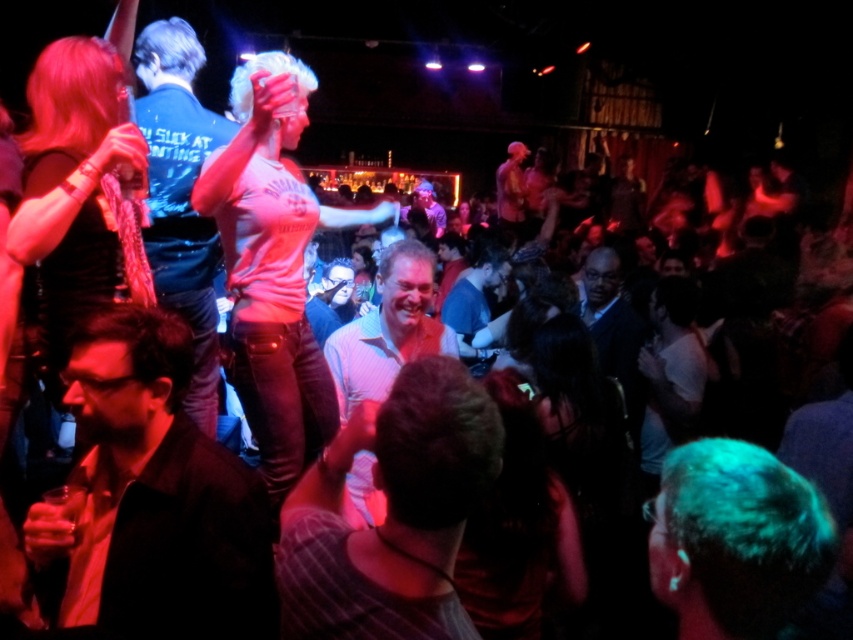
You are at a party and want to find the person with the shiny metallic shirt at center. Which direction should you look relative to the green matte hair at lower right?

The shiny metallic shirt at center is taller than the green matte hair at lower right, so you should look upward from the green matte hair at lower right to find the shiny metallic shirt at center.

You are standing in the nightclub and want to move towards the two points marked in the image. Which point, point (196, 611) or point (119, 236), is closer to you?

Point (196, 611) is closer to the viewer than point (119, 236).

You are a photographer at the event and want to capture both the striped shirt at center and the pink matte shirt at center in a single frame. Which shirt should you focus on to ensure both are in the frame without cropping?

The striped shirt at center is smaller than the pink matte shirt at center, so focusing on the pink matte shirt at center will allow both to be captured without cropping since it takes up more space in the frame.